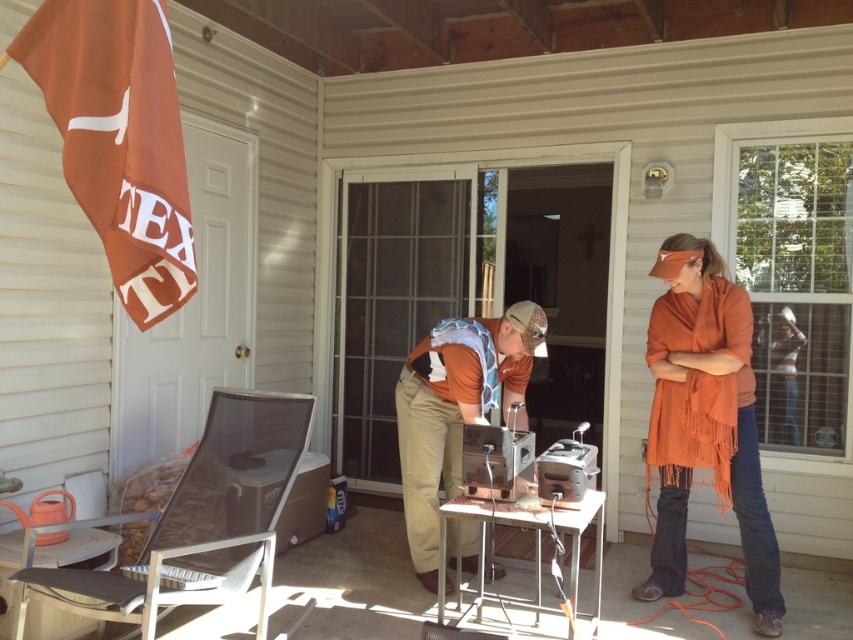
Question: Among these objects, which one is nearest to the camera?

Choices:
 (A) satin silver toaster at center
 (B) orange fringed scarf at right

Answer: (A)

Question: Can you confirm if orange fabric at center is positioned below satin silver toaster at center?

Choices:
 (A) no
 (B) yes

Answer: (B)

Question: Which object is farther from the camera taking this photo?

Choices:
 (A) orange fringed scarf at right
 (B) satin silver toaster at center
 (C) orange fabric at center

Answer: (A)

Question: Is orange fringed scarf at right to the left of orange fabric at center from the viewer's perspective?

Choices:
 (A) yes
 (B) no

Answer: (B)

Question: Which object appears farthest from the camera in this image?

Choices:
 (A) orange fabric at center
 (B) satin silver toaster at center

Answer: (A)

Question: Does orange fringed scarf at right appear over orange fabric at center?

Choices:
 (A) yes
 (B) no

Answer: (A)